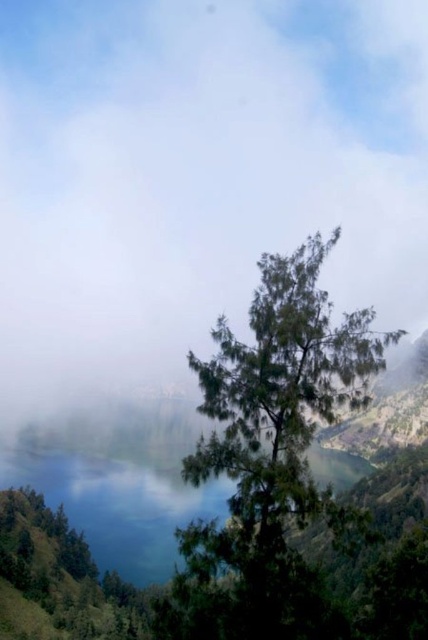
Question: Does white fluffy morning fog at center appear on the right side of green leafy tree at center?

Choices:
 (A) no
 (B) yes

Answer: (B)

Question: Can you confirm if white fluffy morning fog at center is bigger than green leafy tree at center?

Choices:
 (A) yes
 (B) no

Answer: (A)

Question: Which point is closer to the camera?

Choices:
 (A) white fluffy morning fog at center
 (B) green leafy tree at center

Answer: (B)

Question: Which of the following is the closest to the observer?

Choices:
 (A) (385, 253)
 (B) (237, 589)

Answer: (B)

Question: Is white fluffy morning fog at center wider than green leafy tree at center?

Choices:
 (A) no
 (B) yes

Answer: (B)